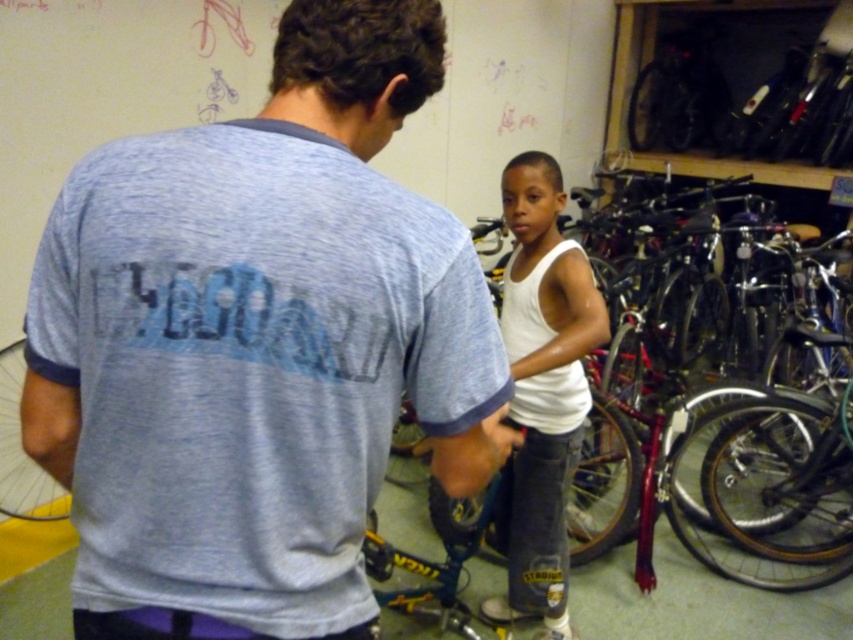
Question: From the image, what is the correct spatial relationship of light blue heathered t-shirt at center in relation to white cotton tank top at center?

Choices:
 (A) left
 (B) right

Answer: (A)

Question: Is light blue heathered t-shirt at center thinner than white cotton tank top at center?

Choices:
 (A) yes
 (B) no

Answer: (B)

Question: Can you confirm if light blue heathered t-shirt at center is thinner than white cotton tank top at center?

Choices:
 (A) yes
 (B) no

Answer: (B)

Question: Among these points, which one is farthest from the camera?

Choices:
 (A) click(235, 369)
 (B) click(548, 288)

Answer: (B)

Question: Which of the following is the farthest from the observer?

Choices:
 (A) (207, 381)
 (B) (576, 282)

Answer: (B)